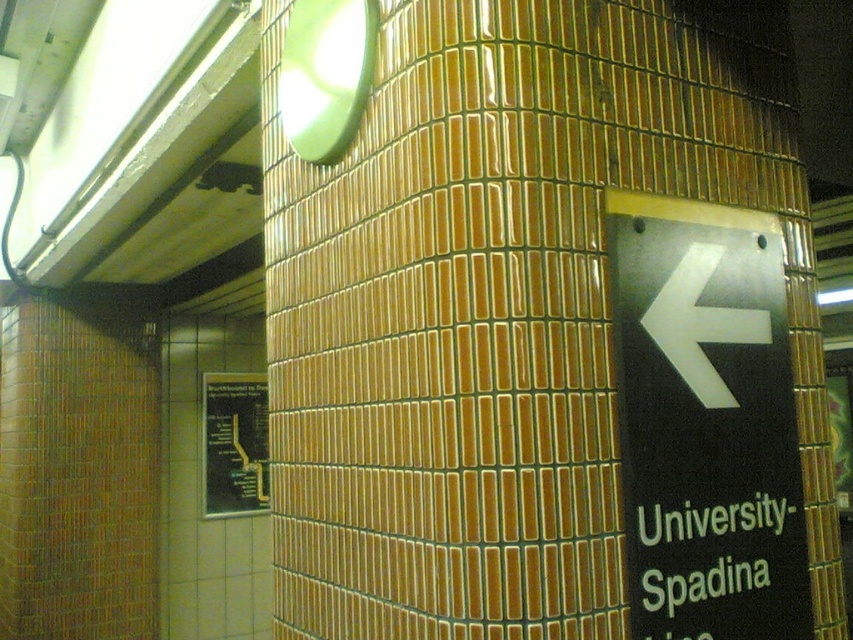
What is the spatial relationship between the green matte sign at lower right and the black glossy map at lower left in the subway station?

The green matte sign at lower right is above the black glossy map at lower left.

You are a subway passenger holding a 3.5 inch wide map. You want to place the map between the black plastic sign at right and the green matte sign at lower right. Can the map fit in the space between them?

The distance between the black plastic sign at right and the green matte sign at lower right is 3.54 inches. Since the map is 3.5 inches wide, it can fit in the space between them as the available space is slightly larger than the map.

You are a passenger in the subway station and need to reach the black glossy map at lower left. However, there is a green matte sign at lower right in your way. Can you easily access the map without moving the sign?

The green matte sign at lower right is in front of the black glossy map at lower left, so you cannot easily access the map without moving the sign.